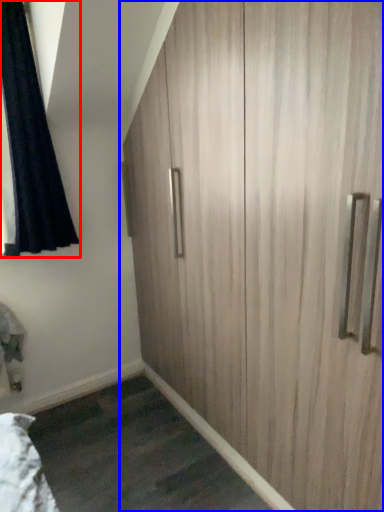
Question: Which of the following is the closest to the observer, curtain (highlighted by a red box) or cupboard (highlighted by a blue box)?

Choices:
 (A) curtain
 (B) cupboard

Answer: (B)